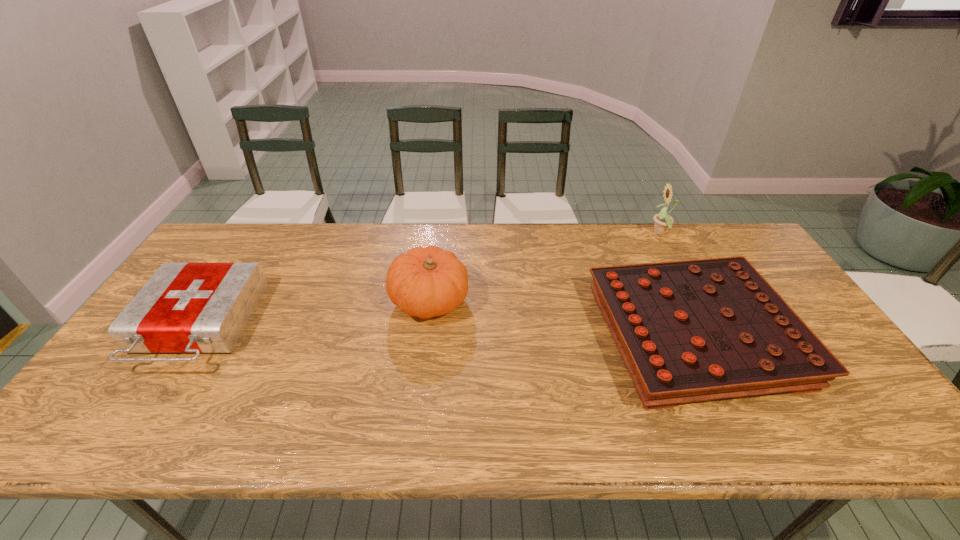
This screenshot has height=540, width=960. I want to click on free location that satisfies the following two spatial constraints: 1. on the front-facing side of the tallest object; 2. on the front side of the leftmost object, so click(710, 326).

Identify the location of vacant area in the image that satisfies the following two spatial constraints: 1. on the front-facing side of the farthest object; 2. on the front side of the leftmost object. (710, 326).

The width and height of the screenshot is (960, 540). Identify the location of vacant space that satisfies the following two spatial constraints: 1. on the front side of the gameboard; 2. on the left side of the first-aid kit. click(x=191, y=336).

Image resolution: width=960 pixels, height=540 pixels. Identify the location of free point that satisfies the following two spatial constraints: 1. on the front-facing side of the sunflower; 2. on the front side of the leftmost object. (710, 326).

Where is `free space that satisfies the following two spatial constraints: 1. on the front-facing side of the tallest object; 2. on the front side of the leftmost object`? free space that satisfies the following two spatial constraints: 1. on the front-facing side of the tallest object; 2. on the front side of the leftmost object is located at coordinates (710, 326).

Identify the location of vacant space that satisfies the following two spatial constraints: 1. on the front side of the gameboard; 2. on the right side of the pumpkin. (425, 336).